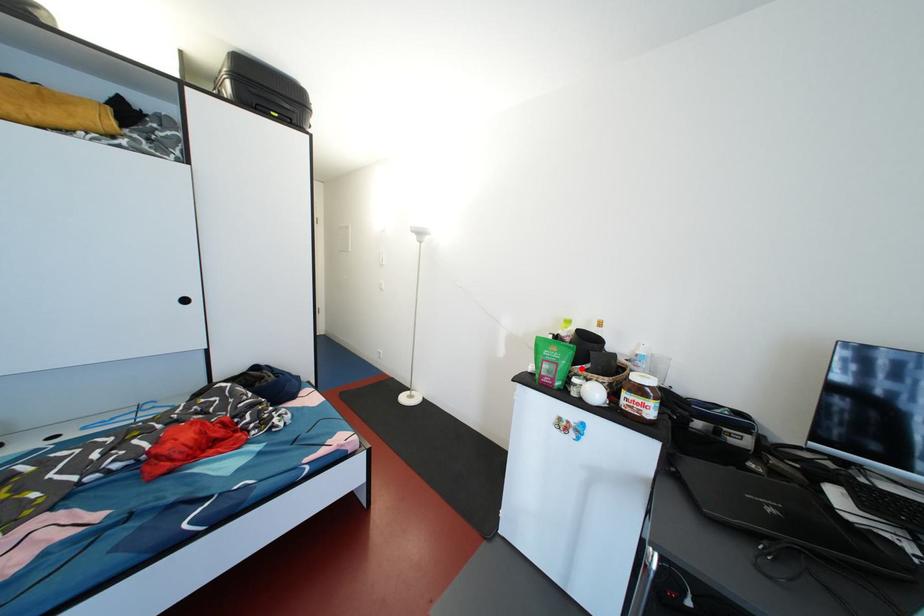
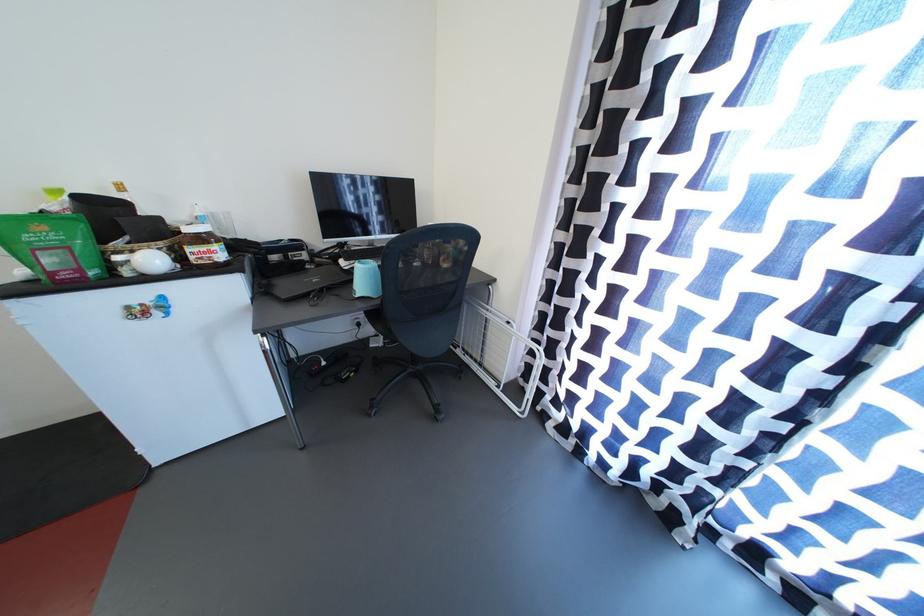
In the second image, find the point that corresponds to the highlighted location in the first image.

(110, 246)